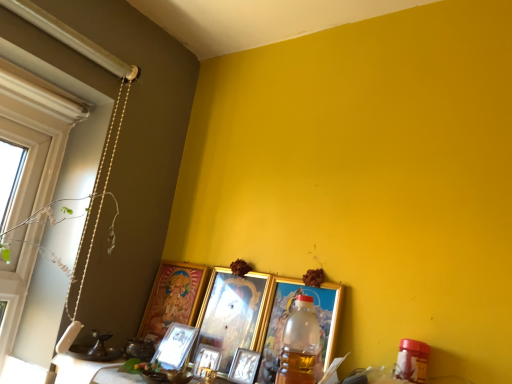
Question: From the image's perspective, is gold-framed picture at lower left, the first picture frame from the left, positioned above or below metallic silver picture frame at lower center, the 2th picture frame from the left?

Choices:
 (A) above
 (B) below

Answer: (A)

Question: Considering the positions of point (157, 342) and point (197, 332), is point (157, 342) closer or farther from the camera than point (197, 332)?

Choices:
 (A) closer
 (B) farther

Answer: (A)

Question: Based on their relative distances, which object is farther from the gold-framed picture at lower left, the first picture frame from the left?

Choices:
 (A) white matte window at left
 (B) pearl necklace at left
 (C) gold metallic picture frame at center, which is counted as the 4th picture frame, starting from the left
 (D) translucent plastic bottle at center
 (E) metallic silver picture frame at center, positioned as the 4th picture frame in right-to-left order

Answer: (A)

Question: Based on their relative distances, which object is farther from the metallic gold table at lower center?

Choices:
 (A) white matte window at left
 (B) metallic silver picture frame at center, positioned as the 4th picture frame in right-to-left order
 (C) pearl necklace at left
 (D) translucent plastic bottle at center
 (E) gold metallic picture frame at center, the third picture frame positioned from the right

Answer: (A)